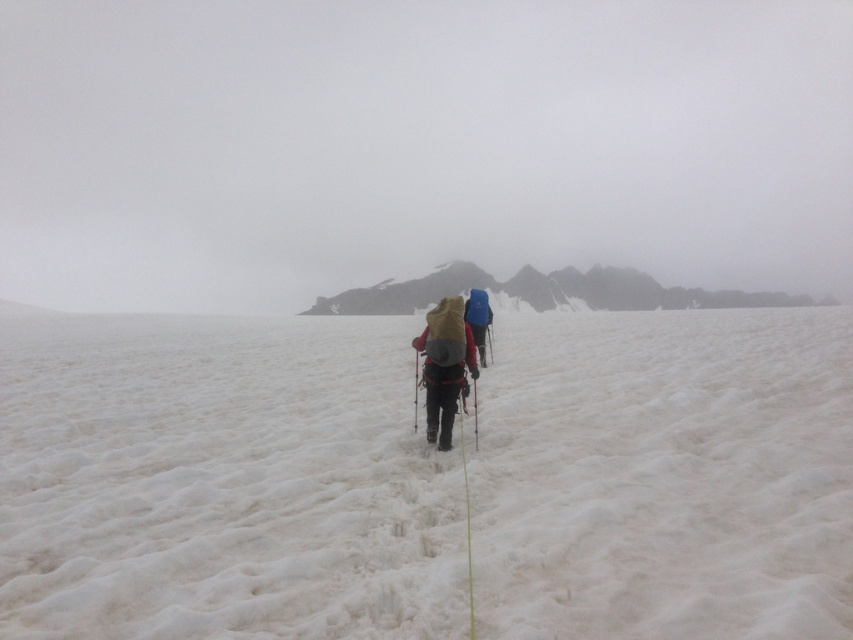
Question: Among these objects, which one is nearest to the camera?

Choices:
 (A) blue fabric backpack at center
 (B) rugged stone mountain at center
 (C) matte yellow backpack at center

Answer: (C)

Question: Which object appears closest to the camera in this image?

Choices:
 (A) rugged stone mountain at center
 (B) white fluffy snow at center
 (C) blue fabric backpack at center

Answer: (B)

Question: Does matte yellow backpack at center appear on the right side of blue fabric backpack at center?

Choices:
 (A) no
 (B) yes

Answer: (A)

Question: Does white fluffy snow at center appear under matte yellow backpack at center?

Choices:
 (A) no
 (B) yes

Answer: (A)

Question: From the image, what is the correct spatial relationship of white fluffy snow at center in relation to blue fabric backpack at center?

Choices:
 (A) above
 (B) below

Answer: (B)

Question: Which point is closer to the camera?

Choices:
 (A) blue fabric backpack at center
 (B) white fluffy snow at center
 (C) rugged stone mountain at center

Answer: (B)